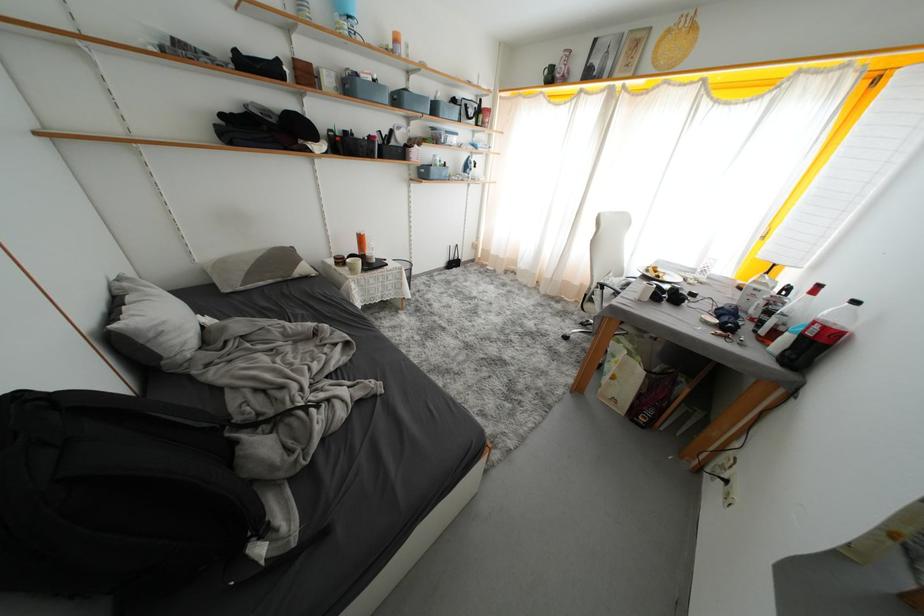
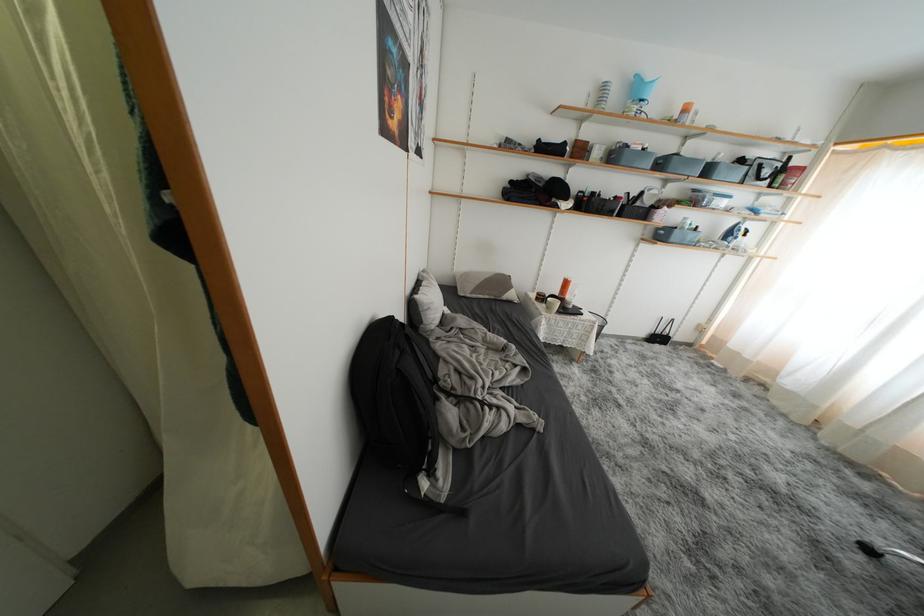
In the second image, find the point that corresponds to pixel 441 113 in the first image.

(714, 175)